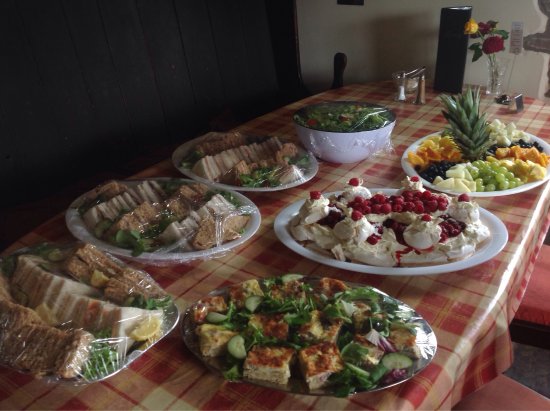
Find the location of a particular element. This screenshot has width=550, height=411. vase is located at coordinates pyautogui.click(x=495, y=72).